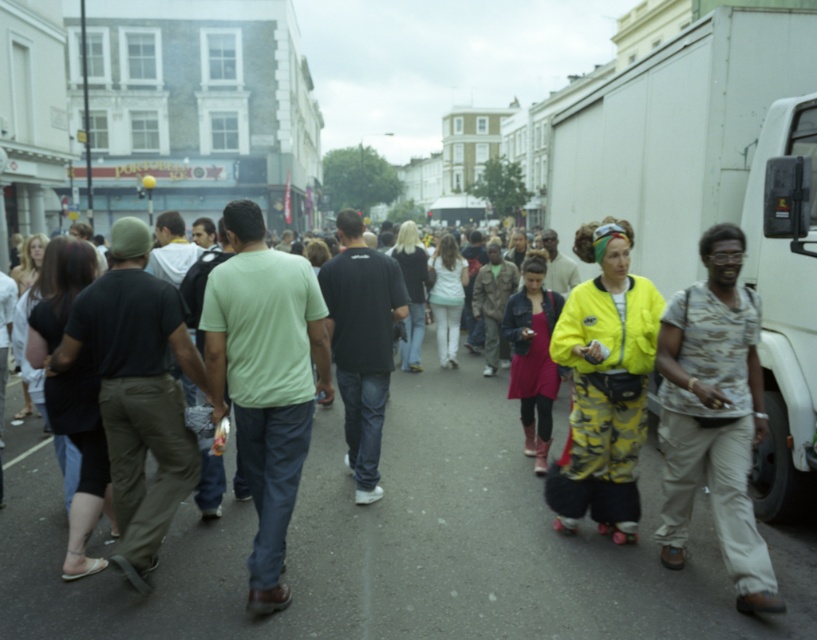
Does light green cotton t-shirt at center appear over camouflage shirt at right?

No, light green cotton t-shirt at center is not above camouflage shirt at right.

Who is lower down, light green cotton t-shirt at center or camouflage shirt at right?

Positioned lower is light green cotton t-shirt at center.

Where is `light green cotton t-shirt at center`? The image size is (817, 640). light green cotton t-shirt at center is located at coordinates (266, 378).

Locate an element on the screen. light green cotton t-shirt at center is located at coordinates click(266, 378).

Between light green cotton t-shirt at center and neon yellow jacket at center, which one has more height?

light green cotton t-shirt at center is taller.

Locate an element on the screen. This screenshot has height=640, width=817. light green cotton t-shirt at center is located at coordinates (266, 378).

The image size is (817, 640). Find the location of `light green cotton t-shirt at center`. light green cotton t-shirt at center is located at coordinates (266, 378).

Between point (45, 531) and point (693, 458), which one is positioned behind?

The point (45, 531) is more distant.

Does camouflage pants at center appear on the right side of camouflage shirt at right?

In fact, camouflage pants at center is to the left of camouflage shirt at right.

Measure the distance between point (490, 584) and camera.

They are 5.89 meters apart.

Find the location of a particular element. This screenshot has height=640, width=817. camouflage pants at center is located at coordinates (378, 544).